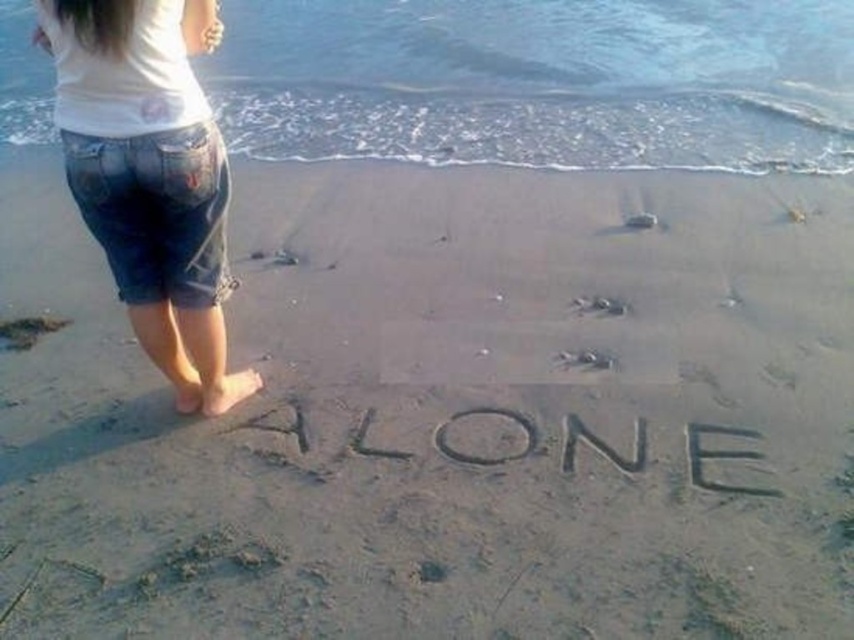
Question: Observing the image, what is the correct spatial positioning of denim shorts at left in reference to sand/textured sand at center?

Choices:
 (A) above
 (B) below

Answer: (A)

Question: Considering the relative positions of denim shorts at left and sand/textured sand at center in the image provided, where is denim shorts at left located with respect to sand/textured sand at center?

Choices:
 (A) above
 (B) below

Answer: (A)

Question: Which of the following is the closest to the observer?

Choices:
 (A) sand/textured sand at center
 (B) denim shorts at left

Answer: (B)

Question: Observing the image, what is the correct spatial positioning of denim shorts at left in reference to sand/textured sand at center?

Choices:
 (A) above
 (B) below

Answer: (A)